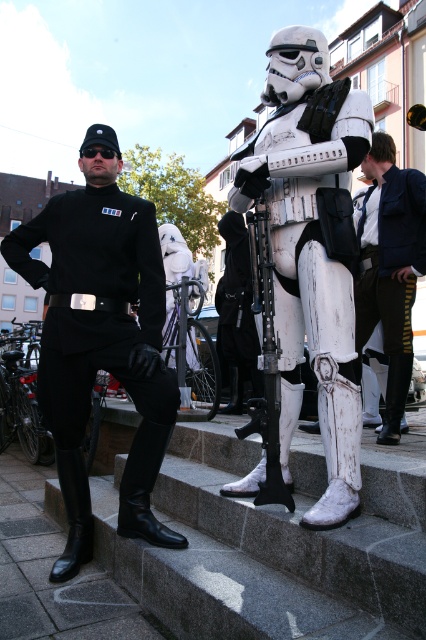
Does black matte uniform at center have a lesser height compared to black leather boot at lower left?

In fact, black matte uniform at center may be taller than black leather boot at lower left.

Which is behind, point (60, 454) or point (89, 541)?

The point (89, 541) is more distant.

Locate an element on the screen. black matte uniform at center is located at coordinates click(x=100, y=337).

Can you confirm if shiny blue vest at center is positioned below black leather boot at lower center?

No, shiny blue vest at center is not below black leather boot at lower center.

Does point (391, 179) lie behind point (169, 436)?

Yes, point (391, 179) is behind point (169, 436).

What are the coordinates of `shiny blue vest at center` in the screenshot? It's located at (389, 268).

Is black leather boot at lower center taller than black leather boot at lower left?

In fact, black leather boot at lower center may be shorter than black leather boot at lower left.

Between black leather boot at lower center and black leather boot at lower left, which one appears on the right side from the viewer's perspective?

Positioned to the right is black leather boot at lower center.

This screenshot has width=426, height=640. What do you see at coordinates (144, 486) in the screenshot?
I see `black leather boot at lower center` at bounding box center [144, 486].

Where is `black leather boot at lower center`? The height and width of the screenshot is (640, 426). black leather boot at lower center is located at coordinates (144, 486).